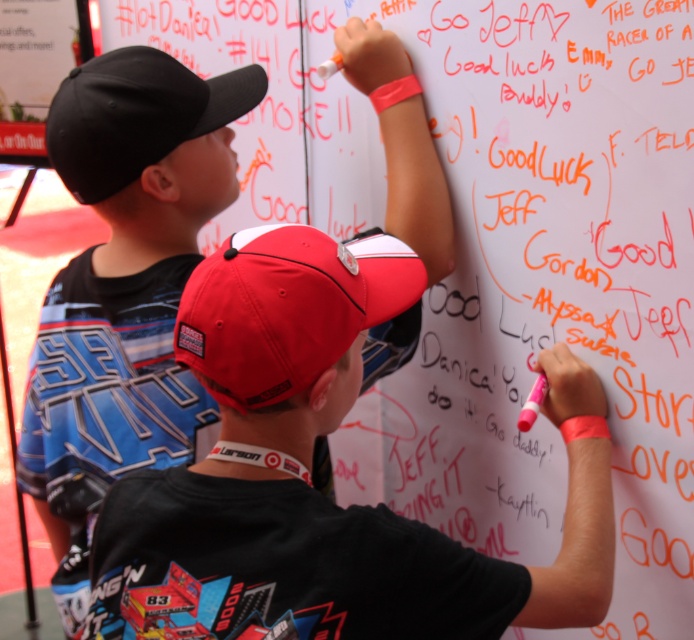
Does point (71, 90) come behind point (282, 300)?

Yes.

Consider the image. Measure the distance between point (219, 125) and camera.

Point (219, 125) is 4.09 feet from camera.

This screenshot has height=640, width=694. Describe the element at coordinates (124, 289) in the screenshot. I see `black matte cap at upper left` at that location.

In order to click on black matte cap at upper left in this screenshot , I will do `click(124, 289)`.

Who is taller, black matte cap at upper left or black fabric baseball cap at upper left?

black matte cap at upper left is taller.

Is point (149, 150) farther from camera compared to point (135, 113)?

That is True.

Image resolution: width=694 pixels, height=640 pixels. I want to click on black matte cap at upper left, so click(x=124, y=289).

From the picture: Is shiny red baseball cap at center positioned before black fabric baseball cap at upper left?

Yes.

Which is above, shiny red baseball cap at center or black fabric baseball cap at upper left?

Positioned higher is black fabric baseball cap at upper left.

Which is behind, point (219, 352) or point (128, 100)?

Positioned behind is point (128, 100).

Where is `shiny red baseball cap at center`? This screenshot has height=640, width=694. shiny red baseball cap at center is located at coordinates (291, 308).